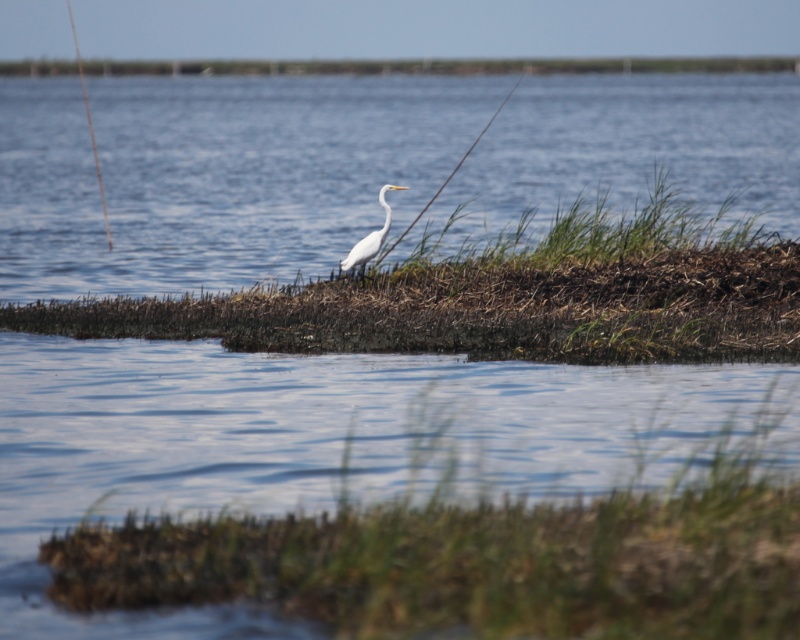
You are a photographer aiming to capture the white bird in the scene. To ensure the green grass at lower center is visible in the background, where should you position your camera relative to the bird?

Position the camera so that the white bird is centered in the frame while keeping the green grass at lower center in the background. Since the green grass at lower center is located at point [478,556], aligning the camera this way will include it in the background behind the bird.

You are a photographer trying to capture the white matte bird at center. You notice there is green grass at lower center in the scene. Will the grass block the bird in your photo?

The green grass at lower center is in front of the white matte bird at center, so it will block the bird in the photo.

You are a small frog that can jump 3 meters. You want to jump from the green grass at lower center to the green grassy patch at center. Can you make it in one jump?

The distance between the green grass at lower center and the green grassy patch at center is 5.85 meters. Since the frog can only jump 3 meters, it cannot reach the green grassy patch at center in a single jump.